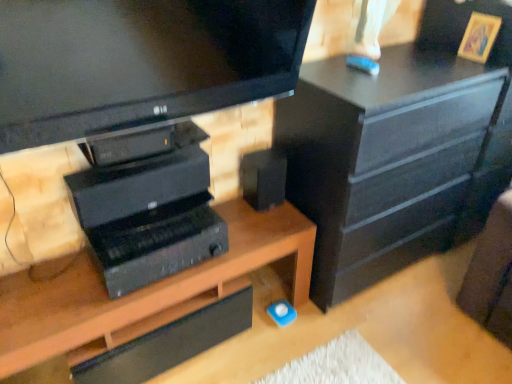
In order to face wooden desk at center, should I rotate leftwards or rightwards?

Rotate your view left by about 12.667°.

Where is `black matte speaker at center`? The image size is (512, 384). black matte speaker at center is located at coordinates (263, 178).

Measure the distance between point (154, 180) and camera.

Point (154, 180) and camera are 1.41 meters apart from each other.

The image size is (512, 384). In order to click on wooden desk at center in this screenshot , I will do `click(141, 291)`.

Could you tell me if wooden desk at center is turned towards black matte speaker at center?

No, wooden desk at center does not turn towards black matte speaker at center.

Is wooden desk at center next to black matte speaker at center?

No, wooden desk at center is not in contact with black matte speaker at center.

Between point (5, 290) and point (262, 196), which one is positioned in front?

Positioned in front is point (5, 290).

From the image's perspective, between black matte chest of drawers at upper right and wooden desk at center, who is located below?

wooden desk at center, from the image's perspective.

Is black matte chest of drawers at upper right facing towards wooden desk at center?

No.

From a real-world perspective, between black matte chest of drawers at upper right and wooden desk at center, who is vertically higher?

black matte chest of drawers at upper right is physically above.

Is black matte speaker at center a part of black matte chest of drawers at upper right?

That's incorrect, black matte speaker at center is not inside black matte chest of drawers at upper right.

Is there a large distance between black matte chest of drawers at upper right and black matte speaker at center?

No, black matte chest of drawers at upper right is not far away from black matte speaker at center.

From the image's perspective, is black matte chest of drawers at upper right above or below black matte speaker at center?

black matte chest of drawers at upper right is above black matte speaker at center.

Is black matte chest of drawers at upper right positioned with its back to black matte speaker at center?

black matte chest of drawers at upper right does not have its back to black matte speaker at center.

Which is nearer, [159,162] or [75,361]?

Point [159,162]

I want to click on computer on the right of wooden desk at center, so click(148, 217).

From the image's perspective, would you say black plastic computer at center is positioned over wooden desk at center?

Indeed, from the image's perspective, black plastic computer at center is shown above wooden desk at center.

Is wooden desk at center at the back of black plastic computer at center?

That's not correct — black plastic computer at center is not looking away from wooden desk at center.

Where is `computer on the right of wooden desk at center`? This screenshot has height=384, width=512. computer on the right of wooden desk at center is located at coordinates (148, 217).

Is wooden desk at center wider than black plastic computer at center?

Yes, wooden desk at center is wider than black plastic computer at center.

Is wooden desk at center not within black plastic computer at center?

Indeed, wooden desk at center is completely outside black plastic computer at center.

Does black matte speaker at center have a lesser width compared to wooden desk at center?

Yes.

Between point (285, 185) and point (60, 287), which one is positioned in front?

The point (60, 287) is closer to the camera.

Is black matte speaker at center facing towards wooden desk at center?

No.

In the scene shown: From a real-world perspective, relative to wooden desk at center, is black matte speaker at center vertically above or below?

In terms of real-world spatial position, black matte speaker at center is above wooden desk at center.

Can you confirm if black plastic computer at center is positioned to the left of black matte chest of drawers at upper right?

Yes.

Is black plastic computer at center oriented towards black matte chest of drawers at upper right?

No.

From a real-world perspective, between black plastic computer at center and black matte chest of drawers at upper right, who is vertically higher?

black plastic computer at center, from a real-world perspective.

Considering the sizes of objects black plastic computer at center and black matte chest of drawers at upper right in the image provided, who is bigger, black plastic computer at center or black matte chest of drawers at upper right?

black matte chest of drawers at upper right.

Find the location of a particular element. The width and height of the screenshot is (512, 384). desk located on the left of black matte speaker at center is located at coordinates (141, 291).

Identify the location of chest of drawers on the right side of wooden desk at center. (392, 160).

Estimate the real-world distances between objects in this image. Which object is closer to black plastic computer at center, black matte chest of drawers at upper right or black matte speaker at center?

Among the two, black matte speaker at center is located nearer to black plastic computer at center.

Considering their positions, is black matte speaker at center positioned closer to wooden desk at center than black matte chest of drawers at upper right?

black matte speaker at center.

From the picture: Estimate the real-world distances between objects in this image. Which object is closer to black matte chest of drawers at upper right, black plastic computer at center or wooden desk at center?

wooden desk at center.

From the image, which object appears to be nearer to black matte chest of drawers at upper right, black matte speaker at center or black plastic computer at center?

black matte speaker at center.

Considering their positions, is black plastic computer at center positioned further to wooden desk at center than black matte chest of drawers at upper right?

Among the two, black matte chest of drawers at upper right is located further to wooden desk at center.

Considering their positions, is black matte speaker at center positioned further to black matte chest of drawers at upper right than wooden desk at center?

Among the two, wooden desk at center is located further to black matte chest of drawers at upper right.

Which object lies further to the anchor point black plastic computer at center, black matte chest of drawers at upper right or wooden desk at center?

Among the two, black matte chest of drawers at upper right is located further to black plastic computer at center.

Considering their positions, is black matte chest of drawers at upper right positioned closer to black matte speaker at center than black plastic computer at center?

black plastic computer at center is closer to black matte speaker at center.

I want to click on speaker between black plastic computer at center and black matte chest of drawers at upper right in the horizontal direction, so click(x=263, y=178).

Identify the location of computer between wooden desk at center and black matte chest of drawers at upper right. (148, 217).

Identify the location of computer located between wooden desk at center and black matte speaker at center in the depth direction. (148, 217).

I want to click on speaker situated between wooden desk at center and black matte chest of drawers at upper right from left to right, so click(263, 178).